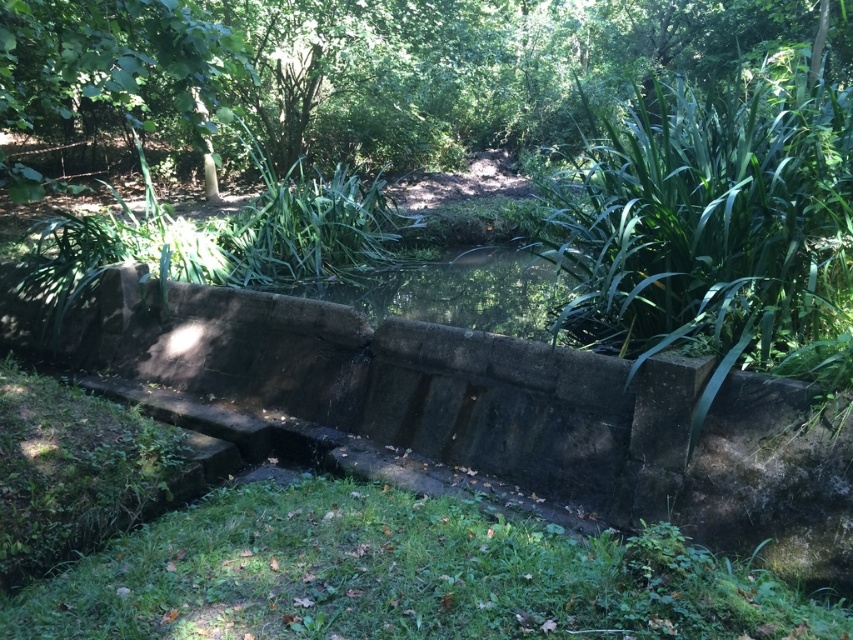
Question: Which point is farther to the camera?

Choices:
 (A) green leafy tree at upper center
 (B) green grassy patch at lower center

Answer: (A)

Question: Is green leafy tree at upper center positioned in front of green grassy patch at lower center?

Choices:
 (A) no
 (B) yes

Answer: (A)

Question: Is green leafy tree at upper center to the right of green grassy patch at lower center from the viewer's perspective?

Choices:
 (A) yes
 (B) no

Answer: (B)

Question: Can you confirm if green leafy tree at upper center is bigger than green grassy patch at lower center?

Choices:
 (A) yes
 (B) no

Answer: (A)